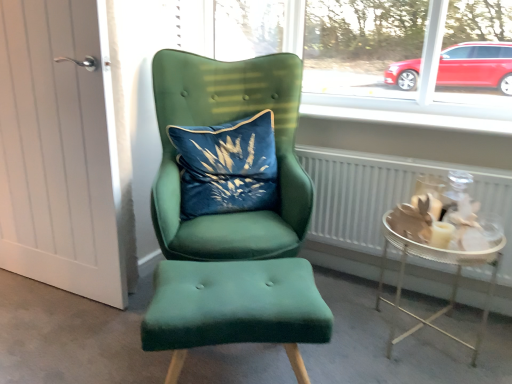
Image resolution: width=512 pixels, height=384 pixels. Describe the element at coordinates (232, 221) in the screenshot. I see `velvet green armchair at center` at that location.

The height and width of the screenshot is (384, 512). What do you see at coordinates (387, 196) in the screenshot?
I see `white textured radiator at lower right` at bounding box center [387, 196].

In order to face metallic silver tray at lower right, should I rotate leftwards or rightwards?

Turn right by 22.301 degrees to look at metallic silver tray at lower right.

What do you see at coordinates (409, 112) in the screenshot? Image resolution: width=512 pixels, height=384 pixels. I see `white smooth window sill at upper center` at bounding box center [409, 112].

Where is `velvet green armchair at center`? This screenshot has height=384, width=512. velvet green armchair at center is located at coordinates (232, 221).

Who is taller, velvet green armchair at center or metallic silver tray at lower right?

velvet green armchair at center is taller.

Considering the sizes of objects velvet green armchair at center and metallic silver tray at lower right in the image provided, who is bigger, velvet green armchair at center or metallic silver tray at lower right?

With larger size is velvet green armchair at center.

From the image's perspective, is velvet green armchair at center below metallic silver tray at lower right?

Actually, velvet green armchair at center appears above metallic silver tray at lower right in the image.

Which object is more forward, velvet green armchair at center or metallic silver tray at lower right?

velvet green armchair at center is more forward.

Are white textured radiator at lower right and velvet green armchair at center located far from each other?

No, white textured radiator at lower right is in close proximity to velvet green armchair at center.

Does white textured radiator at lower right have a smaller size compared to velvet green armchair at center?

Yes, white textured radiator at lower right is smaller than velvet green armchair at center.

This screenshot has width=512, height=384. I want to click on radiator that is behind the velvet green armchair at center, so click(387, 196).

Is white smooth window sill at upper center oriented towards velvet green armchair at center?

No.

From a real-world perspective, is white smooth window sill at upper center on top of velvet green armchair at center?

Yes.

What's the angular difference between white smooth window sill at upper center and velvet green armchair at center's facing directions?

white smooth window sill at upper center and velvet green armchair at center are facing 35.9 degrees away from each other.

Which point is more forward, [366,111] or [147,319]?

The point [147,319] is closer.

From a real-world perspective, is white wood door at left positioned above or below velvet green stool at center?

Clearly, from a real-world perspective, white wood door at left is above velvet green stool at center.

Is the depth of white wood door at left greater than that of velvet green stool at center?

Yes, it is behind velvet green stool at center.

Is white wood door at left shorter than velvet green stool at center?

Incorrect, the height of white wood door at left does not fall short of that of velvet green stool at center.

Is white wood door at left positioned far away from velvet green stool at center?

No, white wood door at left is not far away from velvet green stool at center.

From the image's perspective, is white smooth window sill at upper center positioned above or below velvet green stool at center?

white smooth window sill at upper center is situated higher than velvet green stool at center in the image.

Between white smooth window sill at upper center and velvet green stool at center, which one has smaller size?

white smooth window sill at upper center is smaller.

Considering the points (323, 117) and (159, 268), which point is behind, point (323, 117) or point (159, 268)?

The point (323, 117) is farther.

This screenshot has width=512, height=384. What are the coordinates of `stool below the velvet blue pillow at center (from a real-world perspective)` in the screenshot? It's located at (234, 308).

Is velvet blue pillow at center far away from velvet green stool at center?

That's not correct — velvet blue pillow at center is a little close to velvet green stool at center.

Which object is positioned more to the left, velvet blue pillow at center or velvet green stool at center?

velvet blue pillow at center is more to the left.

From the image's perspective, who appears lower, velvet blue pillow at center or metallic silver tray at lower right?

metallic silver tray at lower right, from the image's perspective.

Looking at this image, from a real-world perspective, is velvet blue pillow at center over metallic silver tray at lower right?

Yes.

Who is bigger, velvet blue pillow at center or metallic silver tray at lower right?

Bigger between the two is metallic silver tray at lower right.

Find the location of a particular element. The width and height of the screenshot is (512, 384). chair located on the left of metallic silver tray at lower right is located at coordinates (232, 221).

This screenshot has height=384, width=512. In order to click on radiator to the right of velvet green armchair at center in this screenshot , I will do coord(387,196).

Based on their spatial positions, is white wood door at left or metallic silver tray at lower right closer to white smooth window sill at upper center?

metallic silver tray at lower right.

When comparing their distances from white wood door at left, does velvet green stool at center or metallic silver tray at lower right seem further?

metallic silver tray at lower right lies further to white wood door at left than the other object.

Looking at this image, when comparing their distances from metallic silver tray at lower right, does white textured radiator at lower right or velvet green stool at center seem further?

Among the two, velvet green stool at center is located further to metallic silver tray at lower right.

Considering their positions, is velvet green stool at center positioned further to metallic silver tray at lower right than white smooth window sill at upper center?

Among the two, velvet green stool at center is located further to metallic silver tray at lower right.

Considering their positions, is white textured radiator at lower right positioned closer to velvet green stool at center than white wood door at left?

white wood door at left.

Looking at the image, which one is located closer to metallic silver tray at lower right, velvet green stool at center or velvet blue pillow at center?

velvet green stool at center is closer to metallic silver tray at lower right.

When comparing their distances from velvet blue pillow at center, does metallic silver tray at lower right or velvet green armchair at center seem further?

metallic silver tray at lower right lies further to velvet blue pillow at center than the other object.

Which object lies nearer to the anchor point white smooth window sill at upper center, white wood door at left or velvet green stool at center?

velvet green stool at center.

You are a GUI agent. You are given a task and a screenshot of the screen. Output one action in this format:
    pyautogui.click(x=<x>, y=<y>)
    Task: Click on the window sill between white wood door at left and metallic silver tray at lower right from left to right
    The image size is (512, 384).
    Given the screenshot: What is the action you would take?
    pyautogui.click(x=409, y=112)

This screenshot has height=384, width=512. Find the location of `window sill situated between velvet green armchair at center and metallic silver tray at lower right from left to right`. window sill situated between velvet green armchair at center and metallic silver tray at lower right from left to right is located at coordinates pos(409,112).

Find the location of a particular element. stool between velvet green armchair at center and white textured radiator at lower right from left to right is located at coordinates (234, 308).

Identify the location of radiator situated between velvet blue pillow at center and metallic silver tray at lower right from left to right. (387, 196).